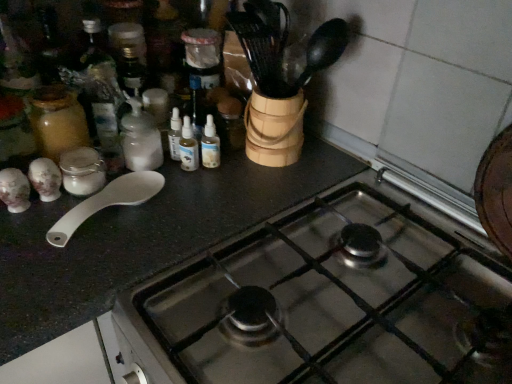
Question: From the image's perspective, is stainless steel gas stove at center under white plastic spoon at left?

Choices:
 (A) yes
 (B) no

Answer: (A)

Question: From a real-world perspective, is stainless steel gas stove at center located higher than white plastic spoon at left?

Choices:
 (A) no
 (B) yes

Answer: (A)

Question: Considering the relative positions of stainless steel gas stove at center and white plastic spoon at left in the image provided, is stainless steel gas stove at center to the right of white plastic spoon at left from the viewer's perspective?

Choices:
 (A) no
 (B) yes

Answer: (B)

Question: Does stainless steel gas stove at center have a lesser height compared to white plastic spoon at left?

Choices:
 (A) yes
 (B) no

Answer: (B)

Question: Is stainless steel gas stove at center wider than white plastic spoon at left?

Choices:
 (A) no
 (B) yes

Answer: (B)

Question: Is stainless steel gas stove at center directly adjacent to white plastic spoon at left?

Choices:
 (A) no
 (B) yes

Answer: (A)

Question: Considering the relative sizes of white plastic spoon at left and white matte bottle at center-left in the image provided, is white plastic spoon at left bigger than white matte bottle at center-left?

Choices:
 (A) no
 (B) yes

Answer: (A)

Question: Considering the relative positions of white plastic spoon at left and white matte bottle at center-left in the image provided, is white plastic spoon at left to the left of white matte bottle at center-left from the viewer's perspective?

Choices:
 (A) no
 (B) yes

Answer: (B)

Question: Considering the relative sizes of white plastic spoon at left and white matte bottle at center-left in the image provided, is white plastic spoon at left shorter than white matte bottle at center-left?

Choices:
 (A) yes
 (B) no

Answer: (A)

Question: From a real-world perspective, is white plastic spoon at left positioned under white matte bottle at center-left based on gravity?

Choices:
 (A) yes
 (B) no

Answer: (A)

Question: Can you confirm if white plastic spoon at left is taller than white matte bottle at center-left?

Choices:
 (A) yes
 (B) no

Answer: (B)

Question: Is the depth of white plastic spoon at left less than that of white matte bottle at center-left?

Choices:
 (A) yes
 (B) no

Answer: (A)

Question: Does white plastic spoon at left appear on the left side of stainless steel gas stove at center?

Choices:
 (A) no
 (B) yes

Answer: (B)